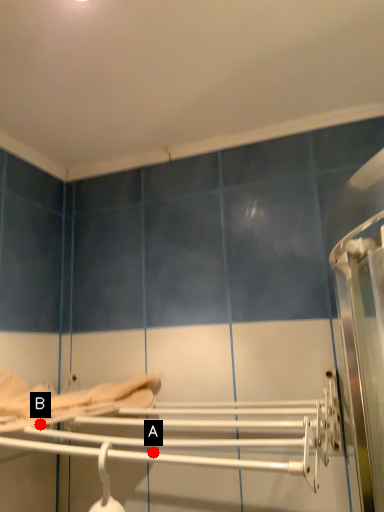
Question: Two points are circled on the image, labeled by A and B beside each circle. Which point is farther to the camera?

Choices:
 (A) A is further
 (B) B is further

Answer: (B)